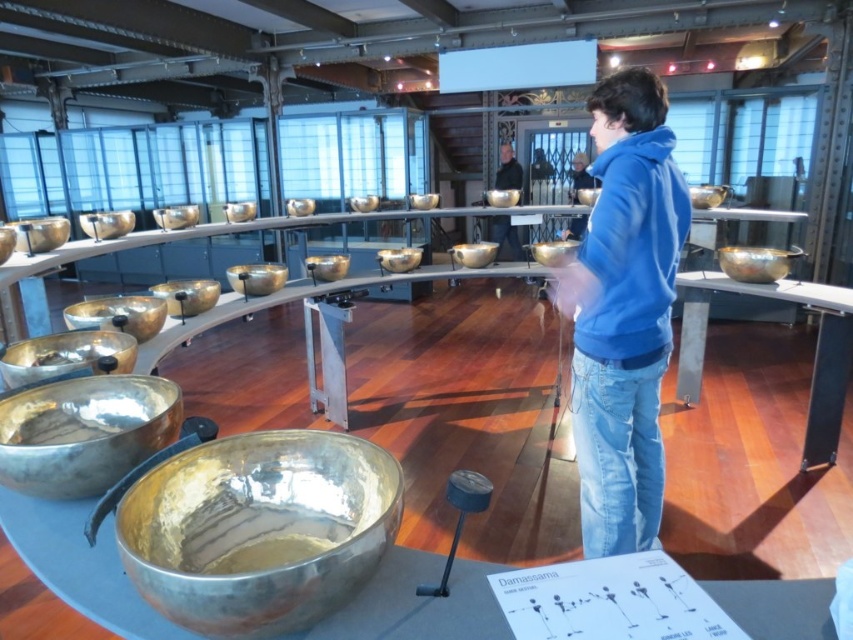
You are a security guard in the museum and need to ensure that the blue cotton hoodie at center and the matte black jacket at center do not block the entrance path. Given that the entrance path is 1.2 meters wide, can both items be placed side by side without obstructing the path?

The blue cotton hoodie at center might be wider than matte black jacket at center. However, since the exact width of the blue cotton hoodie at center is not provided, it is uncertain whether both items placed side by side would fit within the 1.2 meters entrance path. Further measurement is required to confirm.